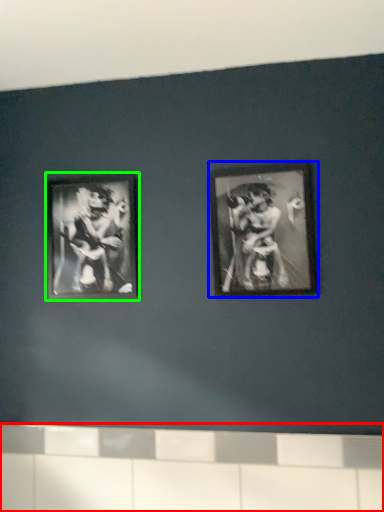
Question: Estimate the real-world distances between objects in this image. Which object is closer to ledge (highlighted by a red box), picture frame (highlighted by a blue box) or picture frame (highlighted by a green box)?

Choices:
 (A) picture frame
 (B) picture frame

Answer: (A)